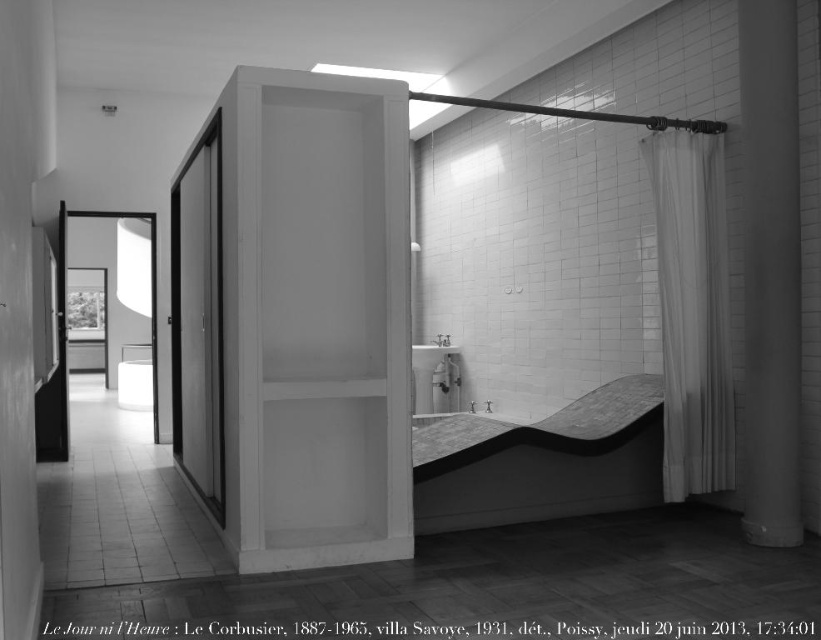
In the Le Corbusier designed bathroom, you need to choose between the smooth gray stone bathtub at lower right and the white glossy sink at center for a cleaning task. Which object requires more cleaning supplies due to its size?

The smooth gray stone bathtub at lower right requires more cleaning supplies because it is larger in size than the white glossy sink at center.

Based on the scene description, where is the smooth gray stone bathtub at lower right located in terms of coordinates?

The smooth gray stone bathtub at lower right is located at coordinates point (542, 461).